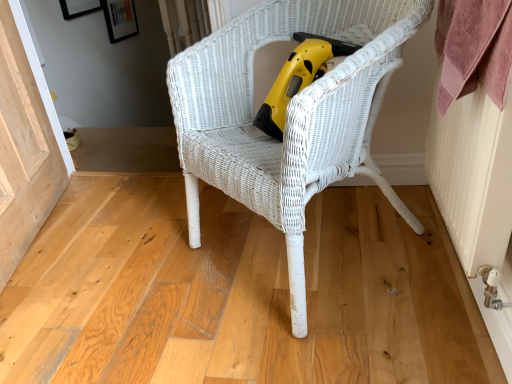
Find the location of a particular element. The image size is (512, 384). free space in front of white wicker chair at center is located at coordinates (326, 344).